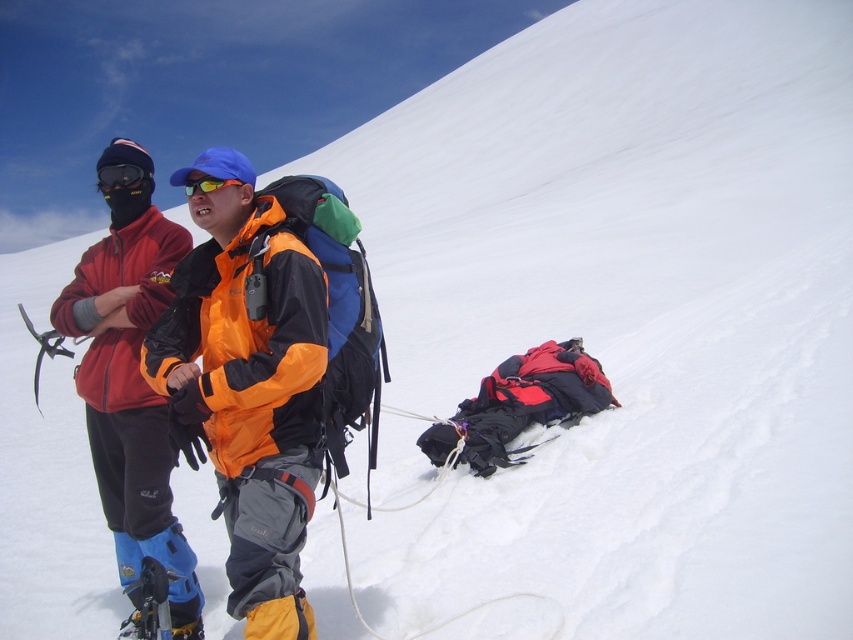
Question: Which point is closer to the camera?

Choices:
 (A) black matte goggles at upper left
 (B) matte orange jacket at center

Answer: (B)

Question: Which of the following is the farthest from the observer?

Choices:
 (A) (94, 465)
 (B) (100, 170)

Answer: (A)

Question: Does matte orange jacket at center have a larger size compared to black matte goggles at upper left?

Choices:
 (A) no
 (B) yes

Answer: (B)

Question: Is matte orange jacket at center to the right of black matte goggles at upper left from the viewer's perspective?

Choices:
 (A) no
 (B) yes

Answer: (B)

Question: Which point appears farthest from the camera in this image?

Choices:
 (A) (178, 230)
 (B) (131, 176)

Answer: (A)

Question: Is matte orange jacket at center smaller than black matte goggles at upper left?

Choices:
 (A) no
 (B) yes

Answer: (A)